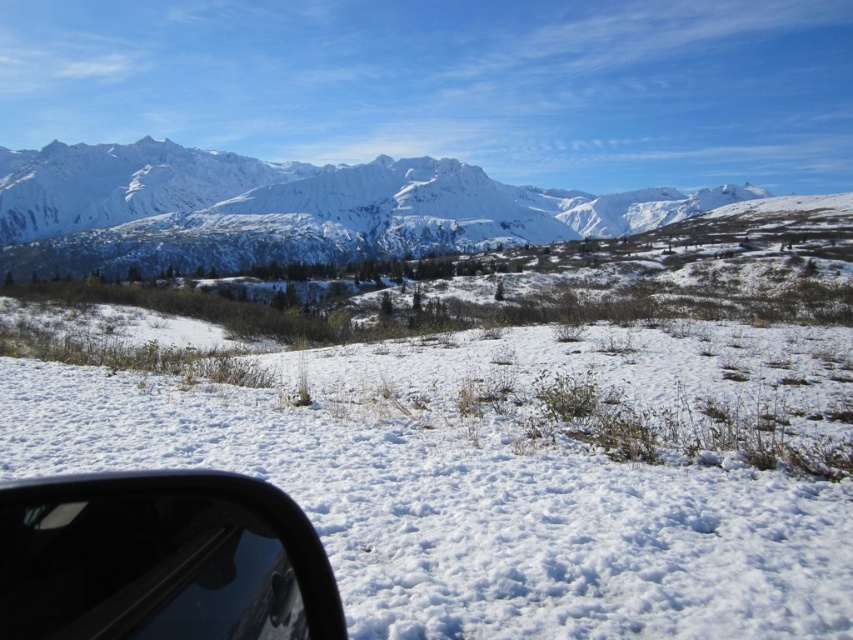
Question: Does white fluffy snow at center have a lesser width compared to black matte car window at lower left?

Choices:
 (A) no
 (B) yes

Answer: (A)

Question: Among these points, which one is nearest to the camera?

Choices:
 (A) pyautogui.click(x=189, y=634)
 (B) pyautogui.click(x=637, y=618)
 (C) pyautogui.click(x=10, y=170)

Answer: (A)

Question: Does snowy granite mountain range at upper left have a greater width compared to black matte car window at lower left?

Choices:
 (A) no
 (B) yes

Answer: (B)

Question: Which of the following is the farthest from the observer?

Choices:
 (A) (717, 588)
 (B) (183, 182)

Answer: (B)

Question: Which of the following is the closest to the observer?

Choices:
 (A) snowy granite mountain range at upper left
 (B) white fluffy snow at center
 (C) black matte car window at lower left

Answer: (C)

Question: Observing the image, what is the correct spatial positioning of white fluffy snow at center in reference to black matte car window at lower left?

Choices:
 (A) left
 (B) right

Answer: (B)